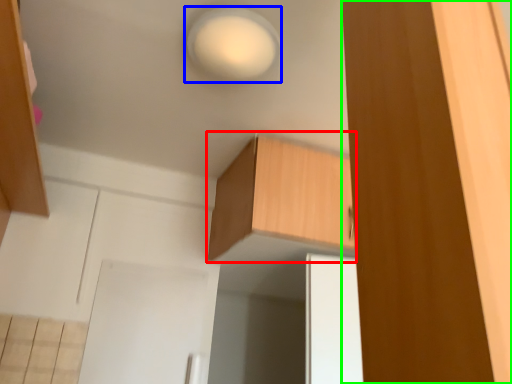
Question: Considering the real-world distances, which object is farthest from cabinetry (highlighted by a red box)? light (highlighted by a blue box) or cabinetry (highlighted by a green box)?

Choices:
 (A) light
 (B) cabinetry

Answer: (B)